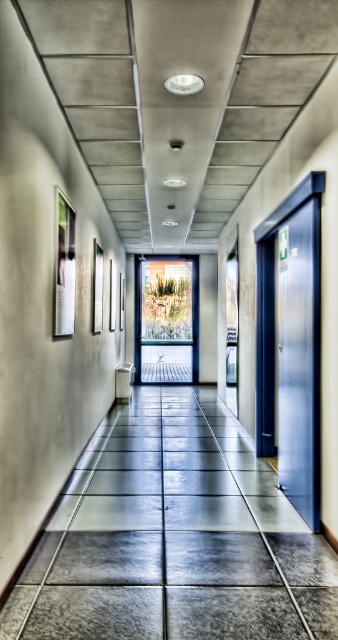
You are standing at the entrance of the corridor and see the point marked as point (174, 538). Where is this point located in the corridor?

The point (174, 538) is on the gray tile floor at center of the corridor.

You are a delivery person carrying a large package that is 1.5 meters long. You are standing on the gray tile floor at center and want to reach the metallic blue door at right. Can you move the package straight ahead without tilting it sideways? Explain your reasoning.

The distance between the gray tile floor at center and the metallic blue door at right is 2.69 meters. Since the package is 1.5 meters long, there is sufficient space to move it straight ahead without tilting it sideways as the available distance is greater than the package length.